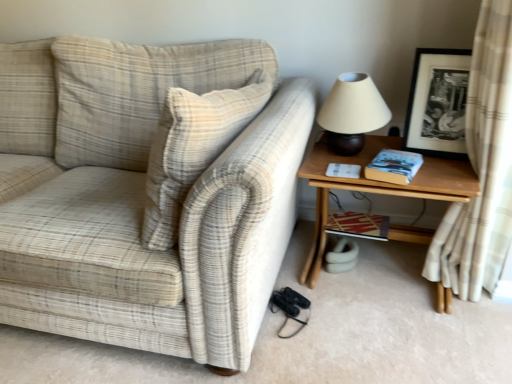
You are a GUI agent. You are given a task and a screenshot of the screen. Output one action in this format:
    pyautogui.click(x=<x>, y=<y>)
    Task: Click on the free spot in front of beige fabric curtain at right
    The width and height of the screenshot is (512, 384).
    Given the screenshot: What is the action you would take?
    pyautogui.click(x=472, y=332)